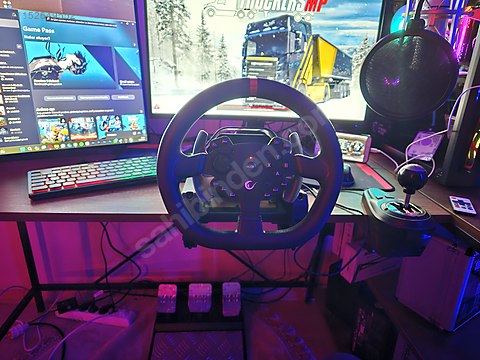
Locate an element on the screen. keyboard is located at coordinates (85, 177).